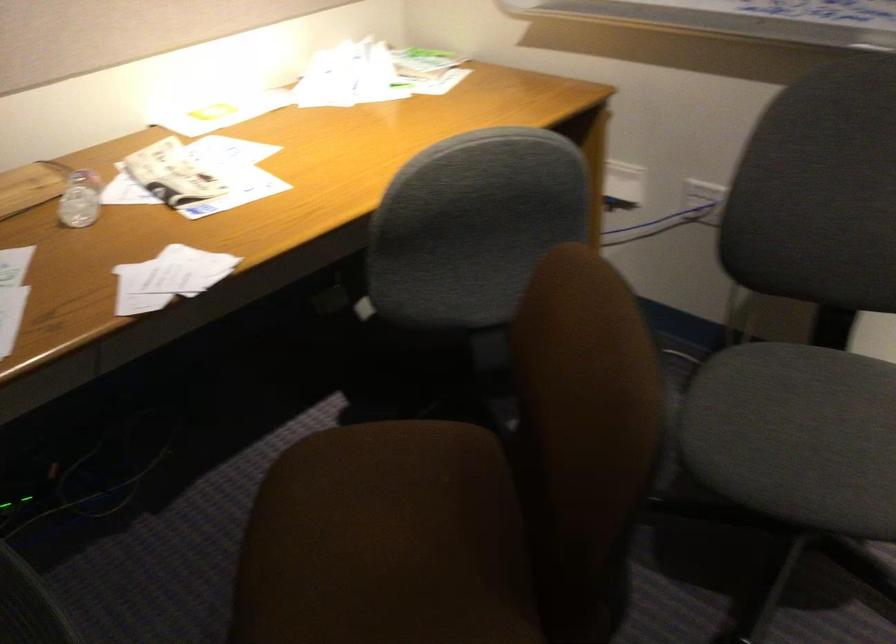
What are the coordinates of `grey chair sitting surface` in the screenshot? It's located at (797, 435).